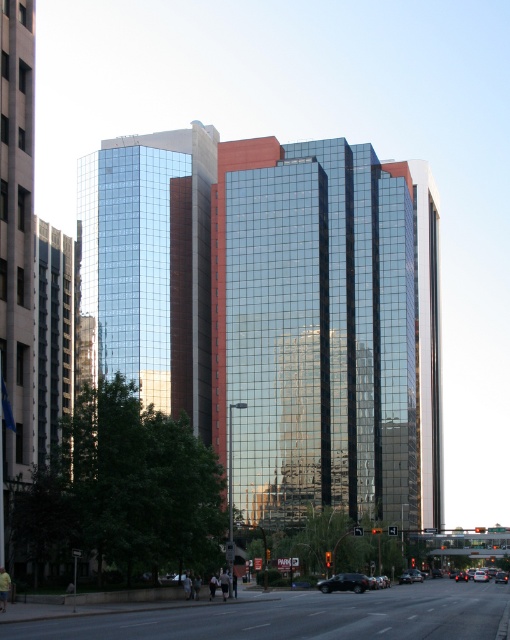
You are standing on the sidewalk in front of the skyscrapers and notice a specific point marked at coordinates (273, 314). What does this point indicate?

The point at coordinates (273, 314) indicates the glossy glass building at center.

You are standing at the origin point of the coordinate system in the image. You want to walk towards the glossy glass building at center. Which direction should you move in terms of the coordinate system?

The glossy glass building at center is located at coordinate point 0.491 in the x direction and 0.537 in the y direction. Therefore, you should move towards the positive x and positive y directions to reach it.

You are a city planner analyzing the urban layout. Given the glossy glass building at center and the shiny black sedan at center, which object occupies more space in the image?

The glossy glass building at center has a larger size compared to the shiny black sedan at center, so it occupies more space in the image.